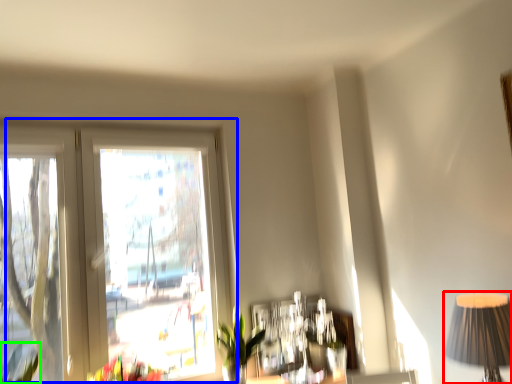
Question: Which is nearer to the table lamp (highlighted by a red box)? window (highlighted by a blue box) or plant (highlighted by a green box).

Choices:
 (A) window
 (B) plant

Answer: (A)